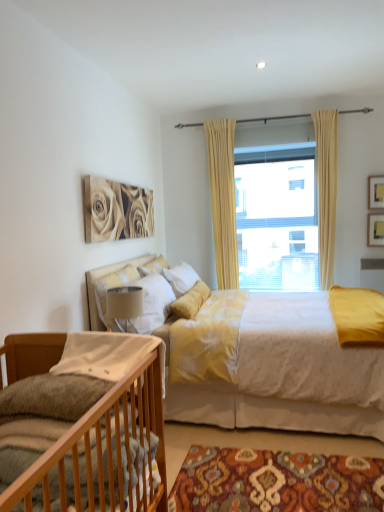
Question: From a real-world perspective, is wooden crib at lower left, which is the 1th bed in front-to-back order, physically located above or below wooden picture frame at upper right, which is counted as the 1th picture frame, starting from the bottom?

Choices:
 (A) below
 (B) above

Answer: (A)

Question: Relative to wooden picture frame at upper right, which is counted as the 1th picture frame, starting from the bottom, is wooden crib at lower left, which is the 1th bed in front-to-back order, in front or behind?

Choices:
 (A) behind
 (B) front

Answer: (B)

Question: Considering the real-world distances, which object is closest to the white soft pillow at upper center, the 1th pillow in the back-to-front sequence?

Choices:
 (A) patterned carpet at lower center
 (B) beige fabric curtain at center
 (C) yellow fabric curtain at center, which appears as the 1th curtain when viewed from the left
 (D) wooden crib at lower left, which is the second bed in back-to-front order
 (E) beige fabric curtain at upper center, acting as the 2th curtain starting from the left

Answer: (B)

Question: Estimate the real-world distances between objects in this image. Which object is farther from the white cotton pillow at lower left, the third pillow when ordered from back to front?

Choices:
 (A) wooden picture frame at upper right, which is the second picture frame in bottom-to-top order
 (B) yellow fabric curtain at center, which is the second curtain from right to left
 (C) velvet yellow bed at center, which is the first bed in back-to-front order
 (D) beige fabric curtain at center
 (E) beige fabric curtain at upper center, the 1th curtain viewed from the right

Answer: (A)